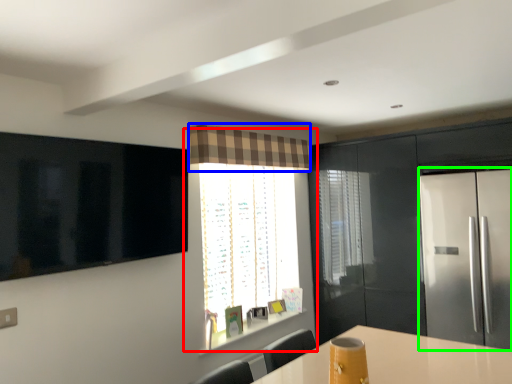
Question: Considering the real-world distances, which object is closest to window (highlighted by a red box)? curtain (highlighted by a blue box) or fridge (highlighted by a green box).

Choices:
 (A) curtain
 (B) fridge

Answer: (A)